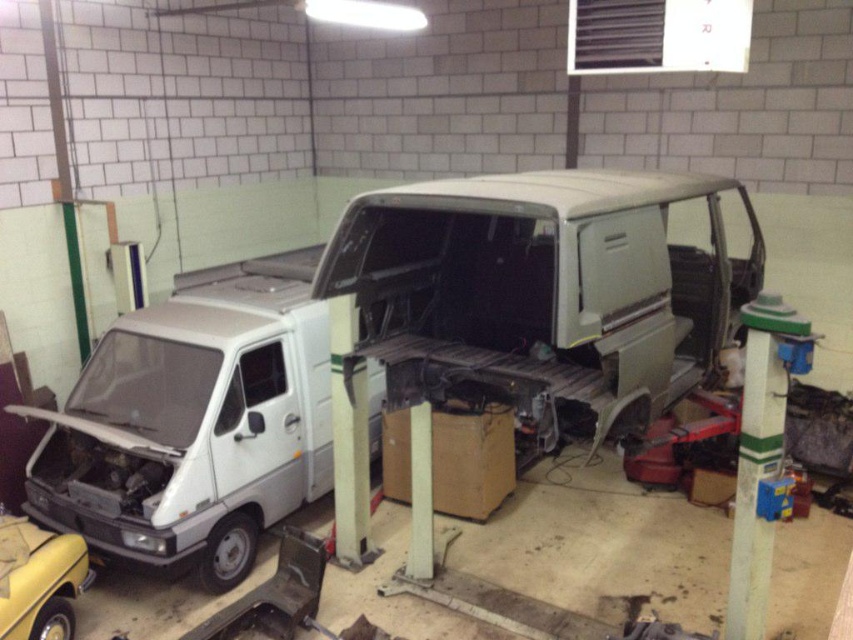
You are a mechanic working in the workshop. You need to reach the point at coordinates point (234, 355) and point (19, 600). Which point is farther away from the entrance of the workshop?

Point (234, 355) is behind point (19, 600), so it is farther away from the entrance of the workshop.

You are a mechanic working in the workshop. You need to determine which vehicle is taller between the white matte van at left and the yellow matte car at lower left. Based on the scene, which one is taller?

The white matte van at left is taller than the yellow matte car at lower left according to the description.